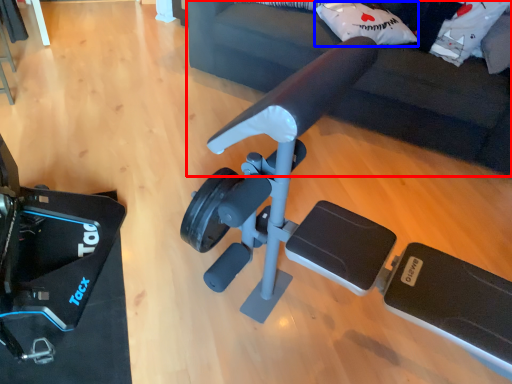
Question: Which object appears closest to the camera in this image, furniture (highlighted by a red box) or pillow (highlighted by a blue box)?

Choices:
 (A) furniture
 (B) pillow

Answer: (A)